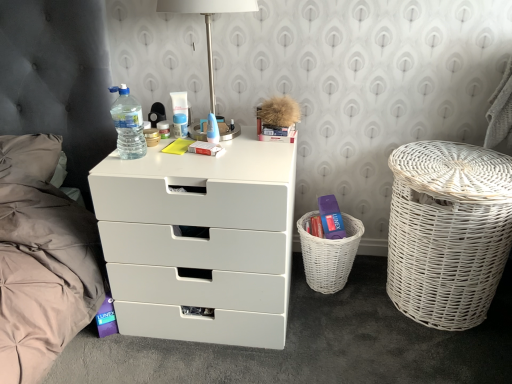
Question: Is satin nickel table lamp at upper center positioned beyond the bounds of dark grey tufted headboard at left?

Choices:
 (A) yes
 (B) no

Answer: (A)

Question: Is satin nickel table lamp at upper center bigger than dark grey tufted headboard at left?

Choices:
 (A) yes
 (B) no

Answer: (B)

Question: Considering the relative sizes of satin nickel table lamp at upper center and dark grey tufted headboard at left in the image provided, is satin nickel table lamp at upper center taller than dark grey tufted headboard at left?

Choices:
 (A) yes
 (B) no

Answer: (B)

Question: From a real-world perspective, is satin nickel table lamp at upper center under dark grey tufted headboard at left?

Choices:
 (A) yes
 (B) no

Answer: (B)

Question: Is satin nickel table lamp at upper center oriented towards dark grey tufted headboard at left?

Choices:
 (A) yes
 (B) no

Answer: (B)

Question: Is the position of satin nickel table lamp at upper center less distant than that of dark grey tufted headboard at left?

Choices:
 (A) yes
 (B) no

Answer: (B)

Question: Is white matte chest of drawers at center closer to camera compared to translucent plastic tube at center, which is the third toiletry in right-to-left order?

Choices:
 (A) yes
 (B) no

Answer: (A)

Question: From the image's perspective, is white matte chest of drawers at center on top of translucent plastic tube at center, the first toiletry in the left-to-right sequence?

Choices:
 (A) no
 (B) yes

Answer: (A)

Question: Does white matte chest of drawers at center turn towards translucent plastic tube at center, which is the third toiletry in right-to-left order?

Choices:
 (A) yes
 (B) no

Answer: (B)

Question: From the image's perspective, is white matte chest of drawers at center below translucent plastic tube at center, which is the third toiletry in right-to-left order?

Choices:
 (A) no
 (B) yes

Answer: (B)

Question: Is translucent plastic tube at center, which is the third toiletry in right-to-left order, at the back of white matte chest of drawers at center?

Choices:
 (A) no
 (B) yes

Answer: (A)

Question: Would you say white matte chest of drawers at center contains translucent plastic tube at center, which is the third toiletry in right-to-left order?

Choices:
 (A) yes
 (B) no

Answer: (B)

Question: From a real-world perspective, is blue plastic container at center, arranged as the third toiletry when viewed from the left, beneath translucent plastic cream at center, acting as the second toiletry starting from the left?

Choices:
 (A) yes
 (B) no

Answer: (A)